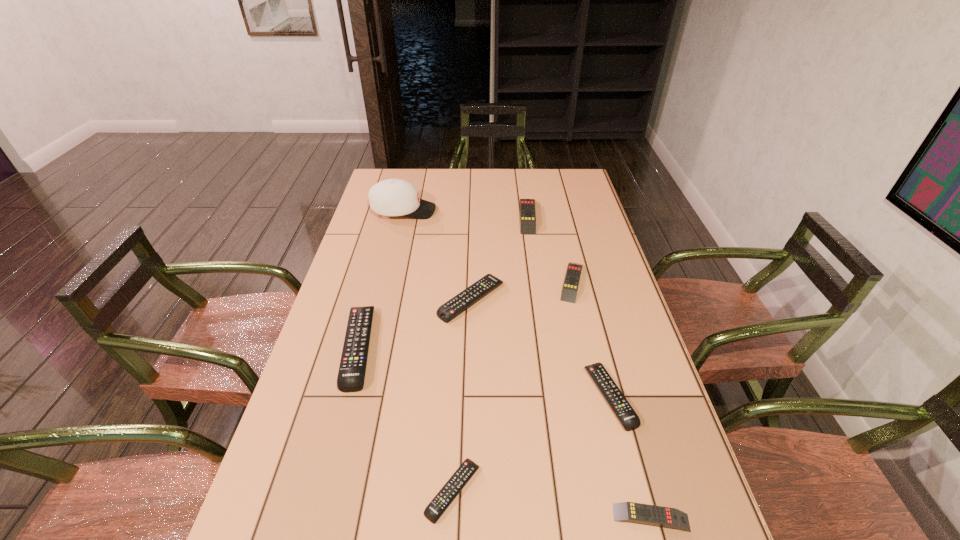
Where is `baseball cap situated at the left edge`? baseball cap situated at the left edge is located at coordinates tap(392, 197).

Image resolution: width=960 pixels, height=540 pixels. I want to click on remote control located in the left edge section of the desktop, so point(351,375).

Locate an element on the screen. The image size is (960, 540). free space at the far edge is located at coordinates (442, 181).

Identify the location of blank space at the left edge of the desktop. (293, 424).

In order to click on vacant space at the right edge of the desktop in this screenshot , I will do `click(660, 471)`.

This screenshot has width=960, height=540. What are the coordinates of `vacant region between the fourth remote control from right to left and the second nearest yellow remote control` in the screenshot? It's located at (550, 249).

Where is `vacant space in between the biggest yellow remote control and the shortest remote control`? Image resolution: width=960 pixels, height=540 pixels. vacant space in between the biggest yellow remote control and the shortest remote control is located at coordinates (491, 353).

The width and height of the screenshot is (960, 540). I want to click on free space between the third smallest black remote control and the fifth object from left to right, so click(499, 258).

The image size is (960, 540). Identify the location of free space between the farthest yellow remote control and the third smallest black remote control. (499, 258).

You are a GUI agent. You are given a task and a screenshot of the screen. Output one action in this format:
    pyautogui.click(x=<x>, y=<y>)
    Task: Click on the free point between the leftmost remote control and the rightmost black remote control
    
    Given the screenshot: What is the action you would take?
    pyautogui.click(x=485, y=372)